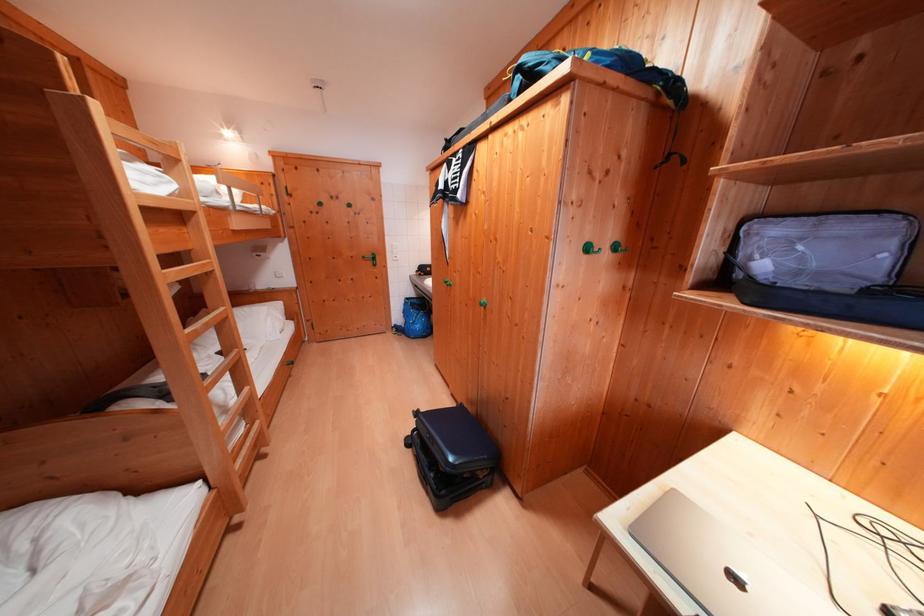
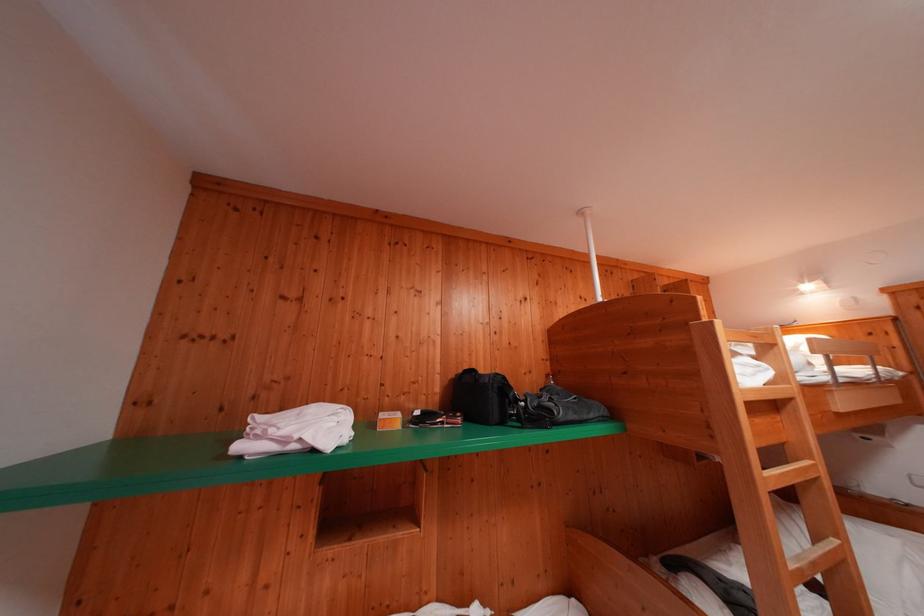
Question: Based on the continuous images, in which direction is the camera rotating? Reply with the corresponding letter.

Choices:
 (A) Left
 (B) Right
 (C) Up
 (D) Down

Answer: (A)